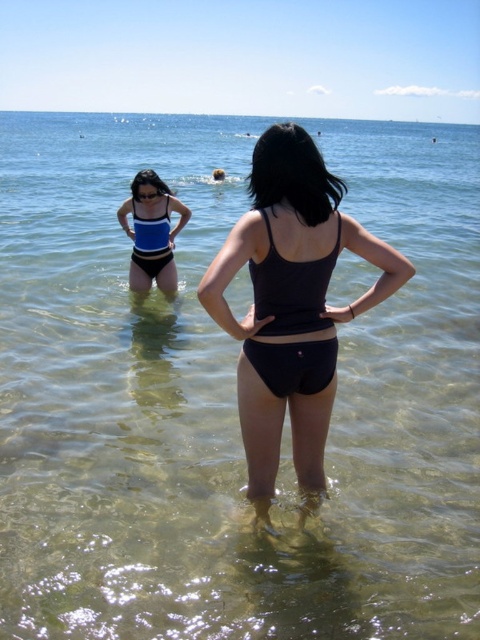
Question: Is black matte swimsuit at center thinner than blue matte bikini at upper center?

Choices:
 (A) no
 (B) yes

Answer: (A)

Question: In this image, where is black matte swimsuit at center located relative to blue matte bikini at upper center?

Choices:
 (A) above
 (B) below

Answer: (B)

Question: Which point is closer to the camera?

Choices:
 (A) black matte swimsuit at center
 (B) blue matte bikini at upper center
 (C) black matte bikini at center
 (D) blue matte swimsuit at upper left

Answer: (A)

Question: Which point appears closest to the camera in this image?

Choices:
 (A) (134, 227)
 (B) (305, 410)

Answer: (B)

Question: Can you confirm if black matte swimsuit at center is wider than blue matte swimsuit at upper left?

Choices:
 (A) no
 (B) yes

Answer: (B)

Question: Which object is positioned closest to the black matte swimsuit at center?

Choices:
 (A) blue matte bikini at upper center
 (B) blue matte swimsuit at upper left
 (C) black matte bikini at center

Answer: (C)